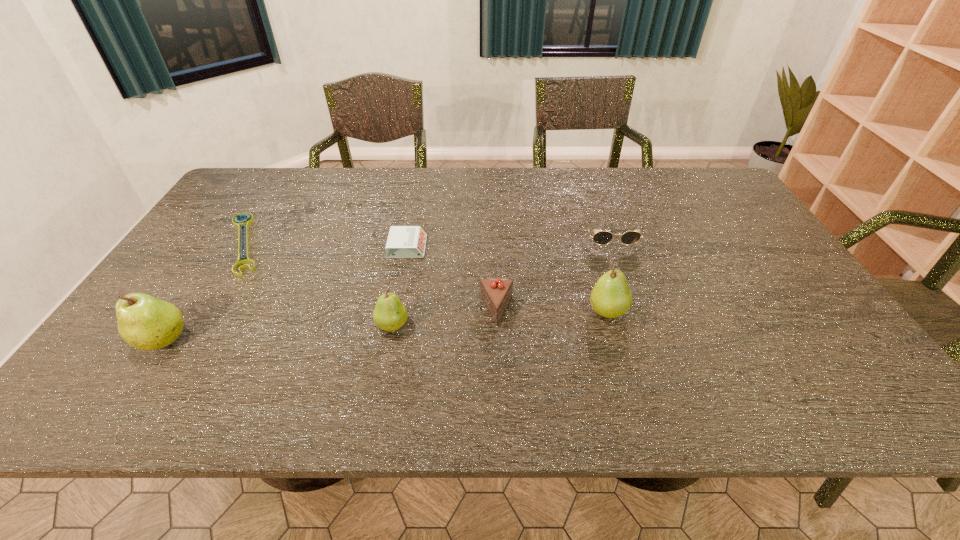
Where is `the tallest pear`? The height and width of the screenshot is (540, 960). the tallest pear is located at coordinates (146, 323).

Identify the location of the tallest object. Image resolution: width=960 pixels, height=540 pixels. (146, 323).

Locate an element on the screen. The height and width of the screenshot is (540, 960). the fifth shortest object is located at coordinates (390, 314).

At what (x,y) coordinates should I click in order to perform the action: click on the second pear from right to left. Please return your answer as a coordinate pair (x, y). The image size is (960, 540). Looking at the image, I should click on (390, 314).

The image size is (960, 540). Identify the location of the second tallest object. (610, 297).

You are a GUI agent. You are given a task and a screenshot of the screen. Output one action in this format:
    pyautogui.click(x=<x>, y=<y>)
    Task: Click on the rightmost pear
    The image size is (960, 540).
    Given the screenshot: What is the action you would take?
    pyautogui.click(x=610, y=297)

This screenshot has height=540, width=960. I want to click on wrench, so click(244, 224).

Locate an element on the screen. alarm clock is located at coordinates pyautogui.click(x=403, y=241).

This screenshot has width=960, height=540. Identify the location of sunglasses. (603, 237).

This screenshot has width=960, height=540. What are the coordinates of `the third object from right to left` in the screenshot? It's located at (496, 293).